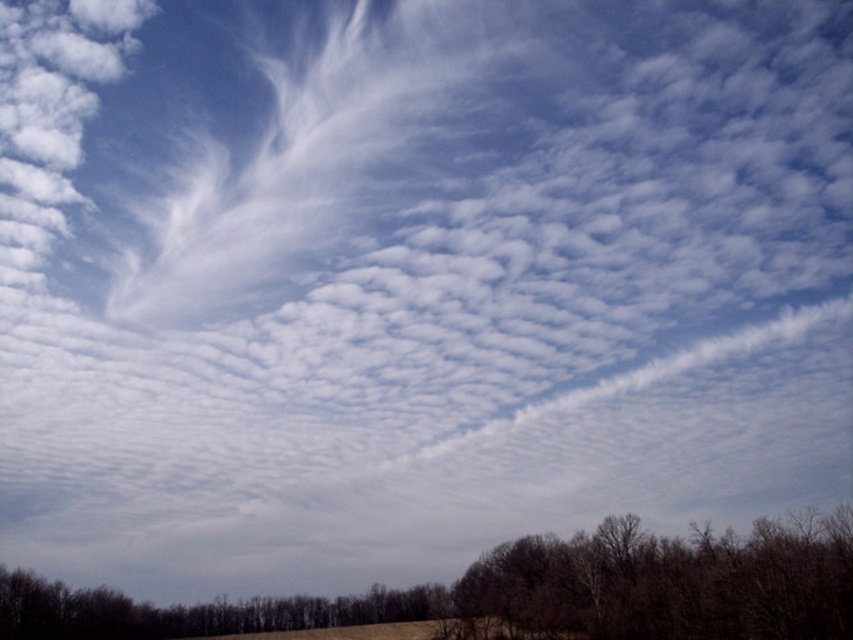
Is point (503, 554) farther from viewer compared to point (834, 604)?

Yes, point (503, 554) is behind point (834, 604).

Can you confirm if brown leafless trees at lower center is shorter than brown matte tree at lower right?

No, brown leafless trees at lower center is not shorter than brown matte tree at lower right.

Which is in front, point (59, 621) or point (668, 636)?

Point (668, 636) is in front.

You are a GUI agent. You are given a task and a screenshot of the screen. Output one action in this format:
    pyautogui.click(x=<x>, y=<y>)
    Task: Click on the brown leafless trees at lower center
    Image resolution: width=853 pixels, height=640 pixels.
    Given the screenshot: What is the action you would take?
    click(525, 593)